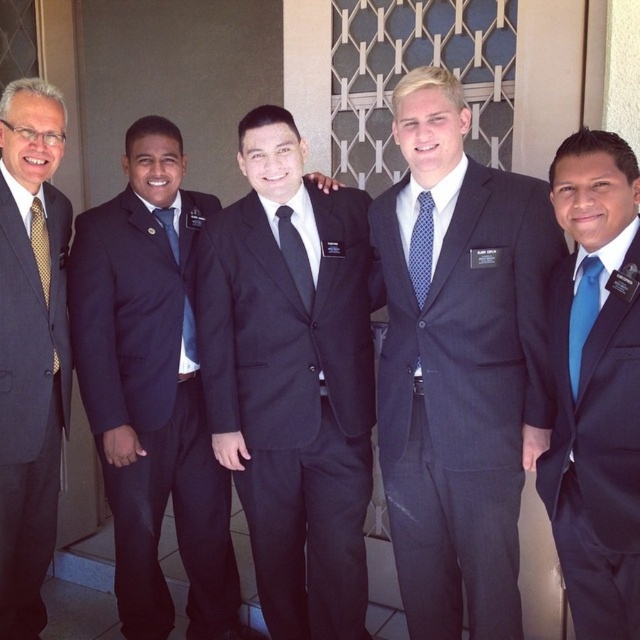
You are a photographer adjusting the camera focus for a group photo. The camera can only focus on objects within a 15 inch range. You notice the black silk tie at center and the matte blue tie at left in the frame. Can both ties be in focus at the same time?

The distance between the black silk tie at center and matte blue tie at left is 18.98 inches, which exceeds the camera focus range of 15 inches. Therefore, both ties cannot be in focus simultaneously.

In the scene shown: You are a photographer adjusting the camera focus. You need to ensure both the blue dotted tie at center and the matte blue tie at left are in focus. Which tie should you focus on first to ensure the other is also in focus?

The blue dotted tie at center is located above the matte blue tie at left. Since it is higher up, focusing on the blue dotted tie at center first would help ensure the matte blue tie at left is also in focus due to their vertical alignment.

You are a photographer adjusting the camera settings to ensure all men in the scene are clearly visible. Given that the blue dotted tie at center and the matte blue tie at left are both in focus, which one might appear smaller in the photo?

The blue dotted tie at center appears smaller in the photo because it occupies less space than the matte blue tie at left.